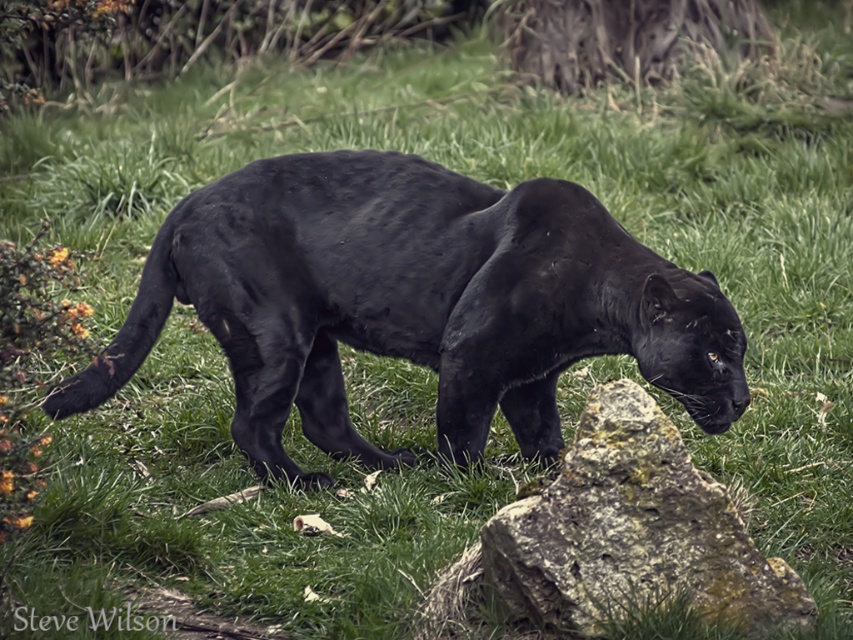
Question: Is matte black panther at center to the left of rough stone boulder at center from the viewer's perspective?

Choices:
 (A) yes
 (B) no

Answer: (A)

Question: Which point appears farthest from the camera in this image?

Choices:
 (A) (589, 508)
 (B) (480, 257)

Answer: (B)

Question: In this image, where is matte black panther at center located relative to rough stone boulder at center?

Choices:
 (A) left
 (B) right

Answer: (A)

Question: Can you confirm if matte black panther at center is smaller than rough stone boulder at center?

Choices:
 (A) no
 (B) yes

Answer: (A)

Question: Among these objects, which one is nearest to the camera?

Choices:
 (A) rough stone boulder at center
 (B) matte black panther at center

Answer: (A)